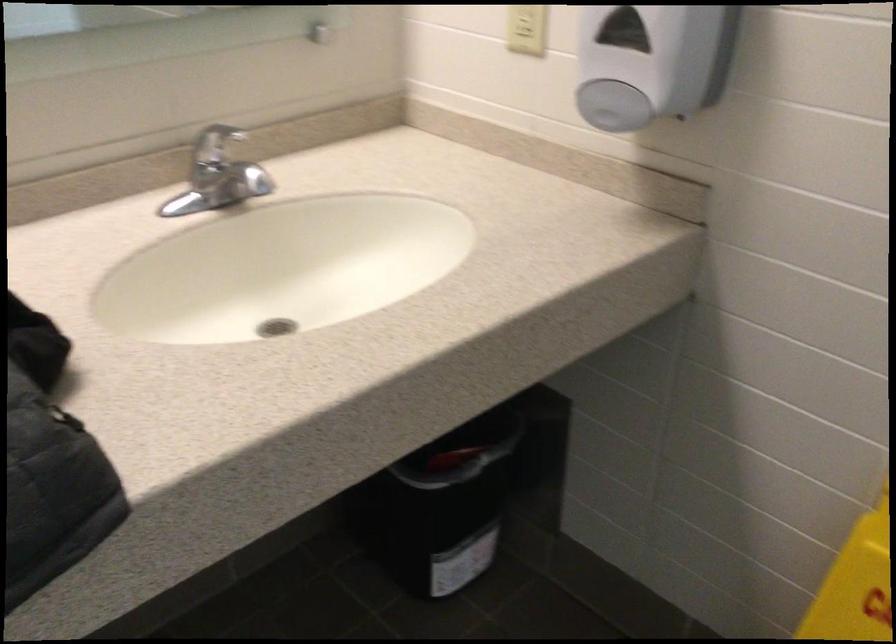
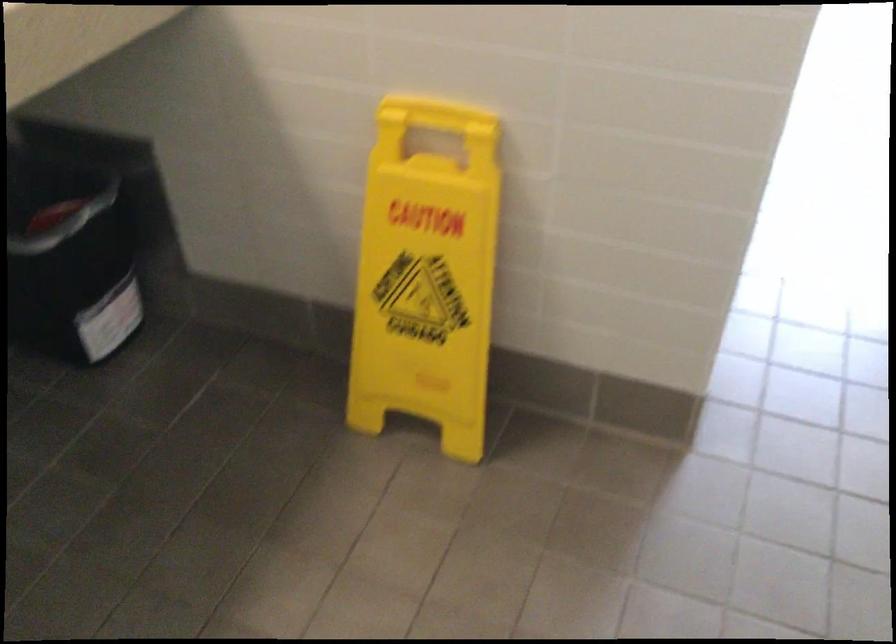
Question: The images are taken continuously from a first-person perspective. In which direction is your viewpoint rotating?

Choices:
 (A) Left
 (B) Right
 (C) Up
 (D) Down

Answer: (B)